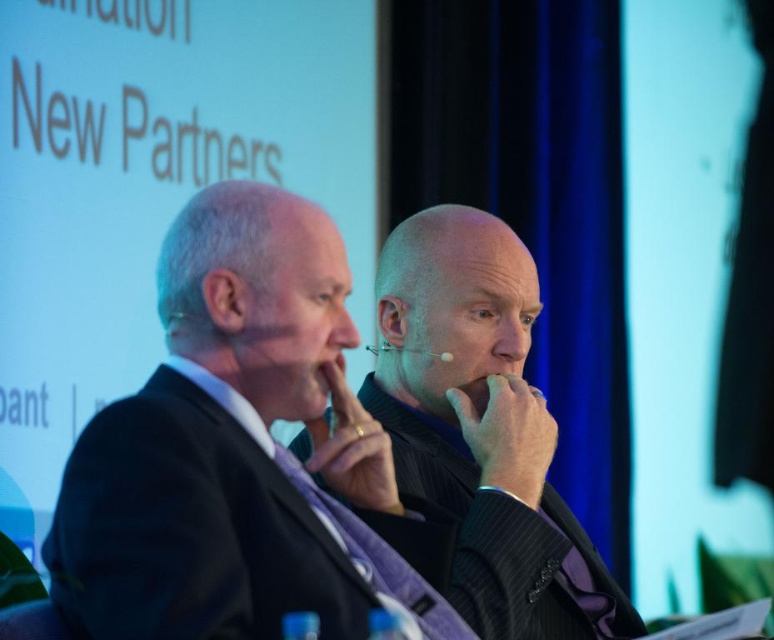
Is point (279, 208) positioned after point (529, 476)?

No.

Does point (259, 321) come farther from viewer compared to point (505, 568)?

No, (259, 321) is closer to viewer.

This screenshot has height=640, width=774. I want to click on black pinstripe suit at center, so click(235, 449).